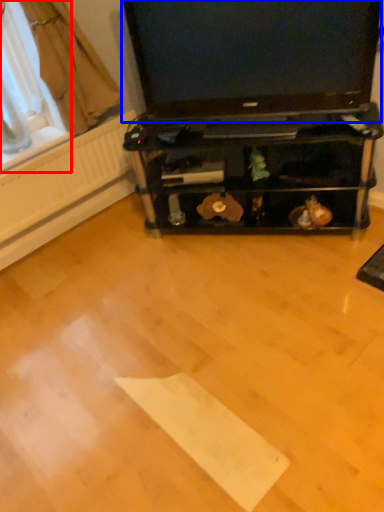
Question: Which object appears closest to the camera in this image, window screen (highlighted by a red box) or television (highlighted by a blue box)?

Choices:
 (A) window screen
 (B) television

Answer: (B)